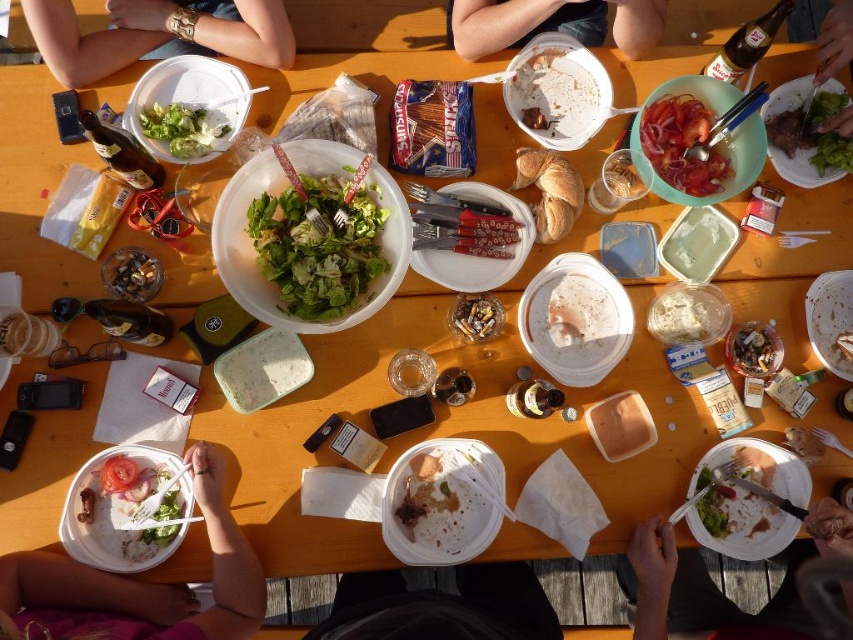
Does smooth skin arm at upper left have a greater width compared to green leafy salad at upper center?

Yes, smooth skin arm at upper left is wider than green leafy salad at upper center.

Which is more to the right, smooth skin arm at upper left or green leafy salad at upper center?

green leafy salad at upper center is more to the right.

I want to click on smooth skin arm at upper left, so click(157, 33).

Is point (277, 259) in front of point (734, 436)?

Yes, point (277, 259) is closer to viewer.

Is green leafy salad at center bigger than white paper plate at lower right?

Indeed, green leafy salad at center has a larger size compared to white paper plate at lower right.

Does point (358, 246) lie in front of point (796, 470)?

Yes.

Where is `green leafy salad at center`? Image resolution: width=853 pixels, height=640 pixels. green leafy salad at center is located at coordinates (320, 246).

Can you confirm if greasy plastic container at center is positioned below green leafy salad at upper left?

Correct, greasy plastic container at center is located below green leafy salad at upper left.

Can you confirm if greasy plastic container at center is shorter than green leafy salad at upper left?

Incorrect, greasy plastic container at center's height does not fall short of green leafy salad at upper left's.

Identify the location of greasy plastic container at center. This screenshot has height=640, width=853. (436, 508).